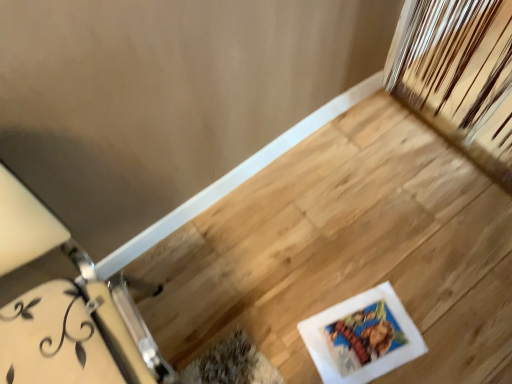
Locate an element on the screen. This screenshot has height=384, width=512. vacant space that is to the left of white glossy picture frame at lower right is located at coordinates (265, 321).